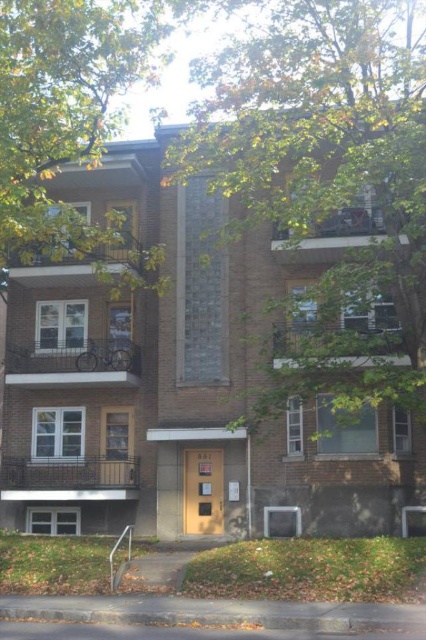
Question: Among these objects, which one is farthest from the camera?

Choices:
 (A) green leafy tree at upper center
 (B) green leafy tree at upper left

Answer: (B)

Question: Is green leafy tree at upper center further to camera compared to green leafy tree at upper left?

Choices:
 (A) yes
 (B) no

Answer: (B)

Question: Among these points, which one is nearest to the camera?

Choices:
 (A) (270, 77)
 (B) (72, 124)

Answer: (A)

Question: Is green leafy tree at upper center closer to camera compared to green leafy tree at upper left?

Choices:
 (A) no
 (B) yes

Answer: (B)

Question: Can you confirm if green leafy tree at upper center is wider than green leafy tree at upper left?

Choices:
 (A) no
 (B) yes

Answer: (B)